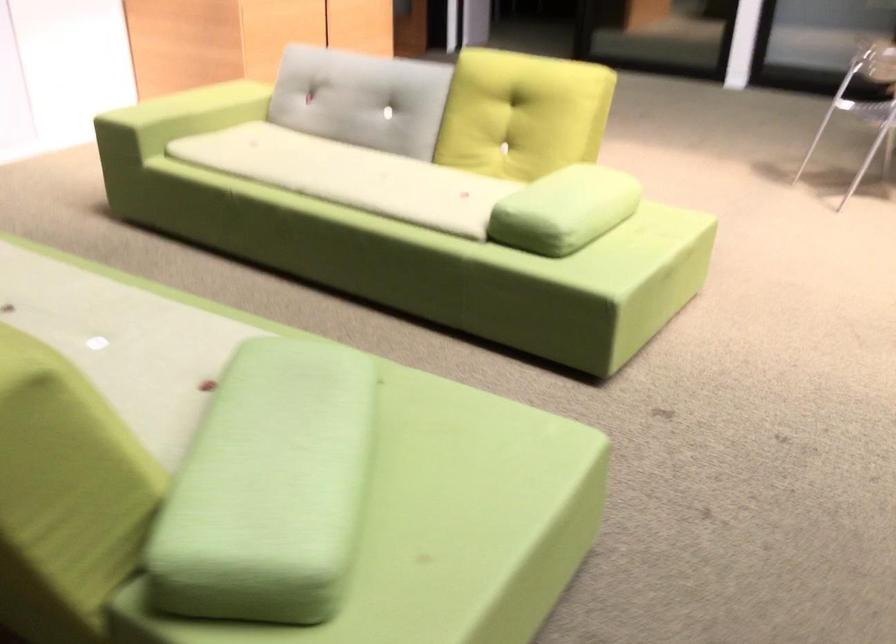
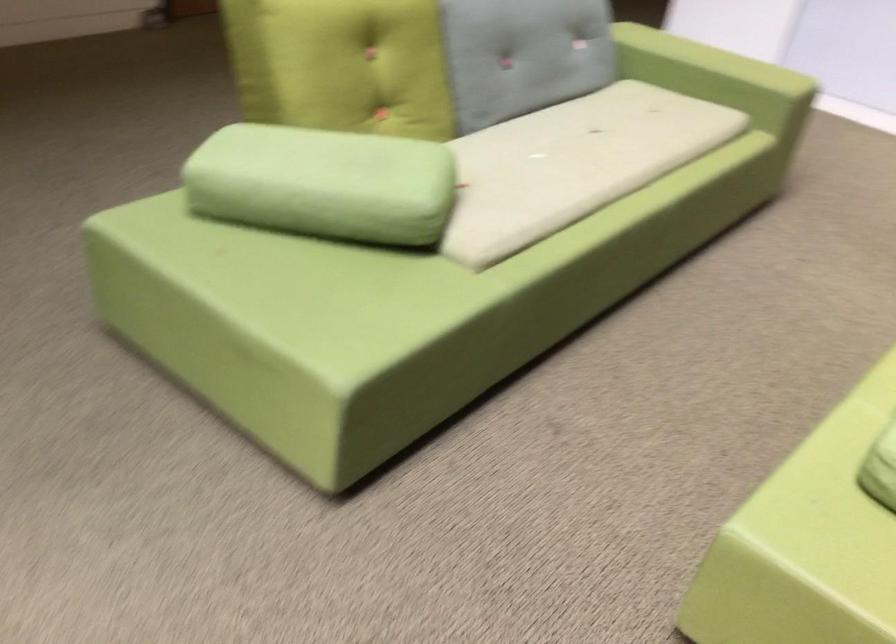
In the second image, find the point that corresponds to (x=359, y=418) in the first image.

(323, 184)